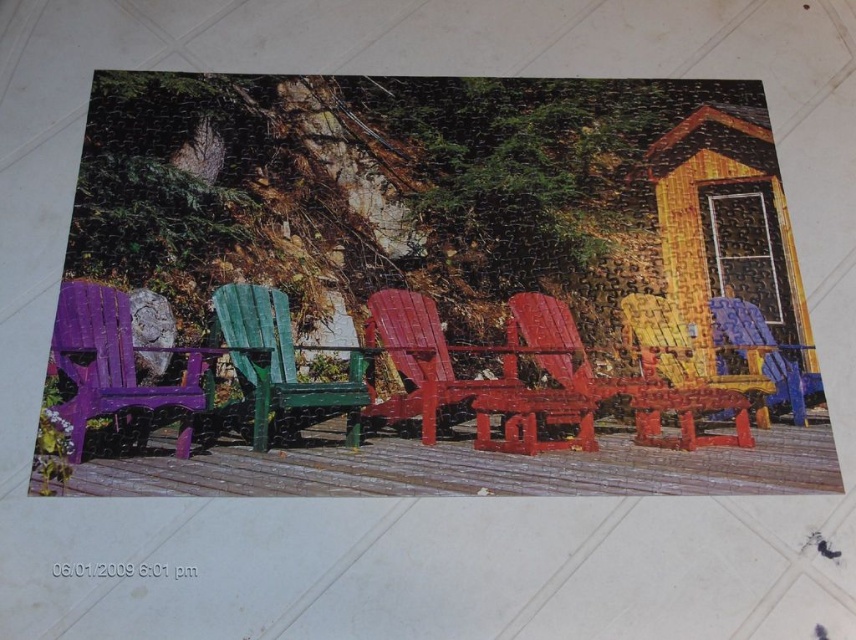
Question: Can you confirm if yellow wood cabin at upper right is positioned above matte red wooden chair at center?

Choices:
 (A) no
 (B) yes

Answer: (B)

Question: Can you confirm if green matte wood chair at center is wider than glossy wood chair at center?

Choices:
 (A) no
 (B) yes

Answer: (B)

Question: Does purple matte plastic chair at left appear on the right side of green matte wood chair at center?

Choices:
 (A) yes
 (B) no

Answer: (A)

Question: Which point appears farthest from the camera in this image?

Choices:
 (A) (383, 410)
 (B) (173, 156)

Answer: (B)

Question: Among these points, which one is nearest to the camera?

Choices:
 (A) (777, 296)
 (B) (461, 401)

Answer: (B)

Question: Which point appears farthest from the camera in this image?

Choices:
 (A) (296, 413)
 (B) (651, 333)

Answer: (B)